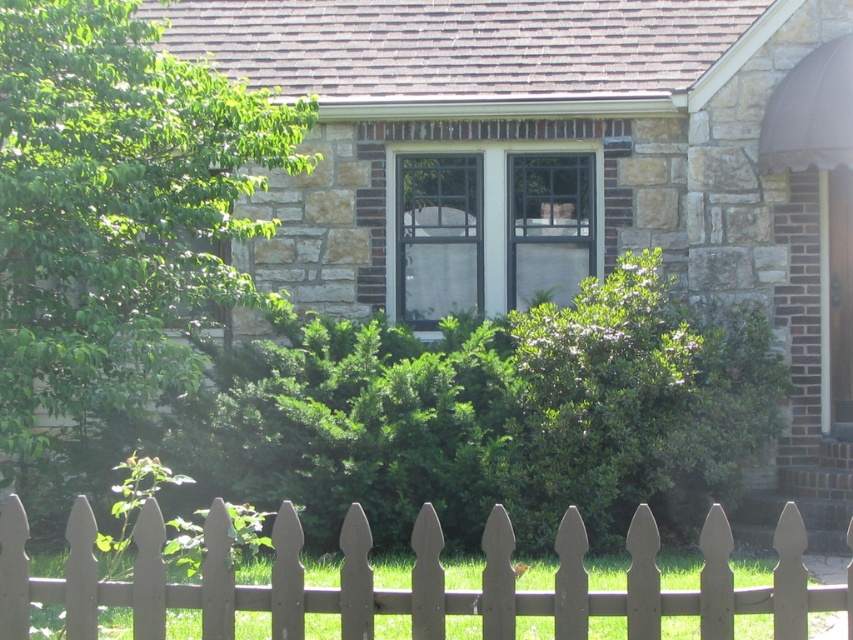
Question: Can you confirm if clear glass screen door at center is thinner than transparent glass screen door at right?

Choices:
 (A) yes
 (B) no

Answer: (B)

Question: Is clear glass window at center thinner than clear glass screen door at center?

Choices:
 (A) yes
 (B) no

Answer: (B)

Question: Is clear glass screen door at center thinner than transparent glass screen door at right?

Choices:
 (A) no
 (B) yes

Answer: (A)

Question: Considering the real-world distances, which object is closest to the clear glass window at center?

Choices:
 (A) clear glass screen door at center
 (B) transparent glass screen door at right

Answer: (A)

Question: Which of these objects is positioned closest to the white picket fence at center?

Choices:
 (A) transparent glass screen door at right
 (B) clear glass window at center

Answer: (A)

Question: Among these points, which one is nearest to the camera?

Choices:
 (A) (234, 609)
 (B) (497, 220)

Answer: (A)